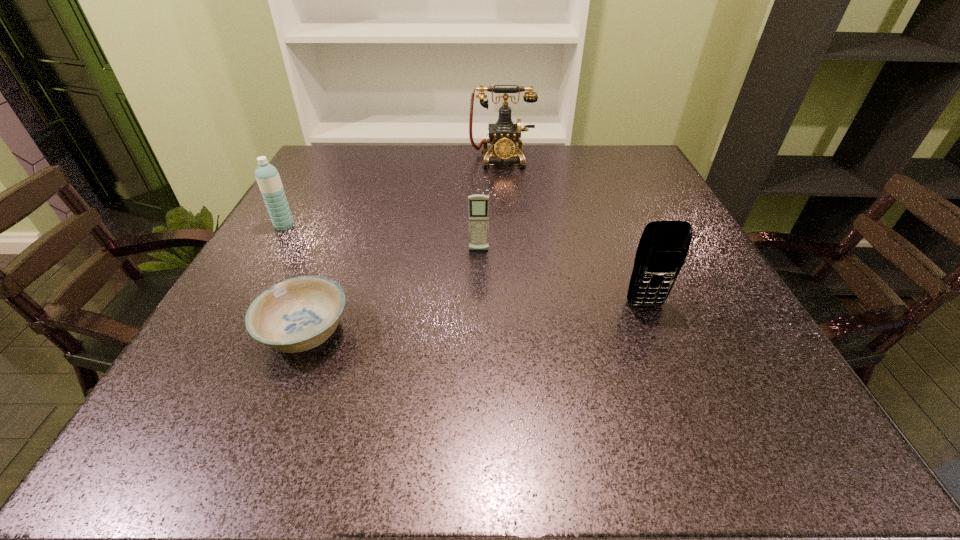
Locate an element on the screen. This screenshot has height=540, width=960. telephone is located at coordinates (504, 134).

Where is `the rightmost object`? This screenshot has width=960, height=540. the rightmost object is located at coordinates (663, 247).

You are a GUI agent. You are given a task and a screenshot of the screen. Output one action in this format:
    pyautogui.click(x=<x>, y=<y>)
    Task: Click on the taller cellular telephone
    This screenshot has height=540, width=960.
    Given the screenshot: What is the action you would take?
    pyautogui.click(x=663, y=247)

Identify the location of the leftmost object. (268, 178).

Locate an element on the screen. The image size is (960, 540). water bottle is located at coordinates (268, 178).

Locate an element on the screen. The width and height of the screenshot is (960, 540). the third nearest object is located at coordinates click(x=478, y=205).

Locate an element on the screen. Image resolution: width=960 pixels, height=540 pixels. the second shortest object is located at coordinates (478, 205).

Where is `bowl`? The height and width of the screenshot is (540, 960). bowl is located at coordinates tap(300, 313).

This screenshot has height=540, width=960. In order to click on the shortest object in this screenshot , I will do `click(300, 313)`.

Find the location of a particular element. The image size is (960, 540). vacant area located on the front of the telephone, featuring the rotary dial is located at coordinates (504, 199).